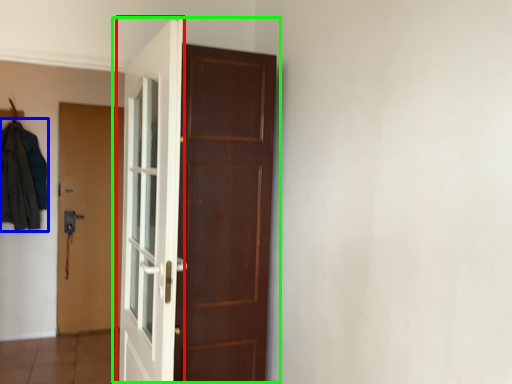
Question: Which object is positioned closest to door (highlighted by a red box)? Select from clothing (highlighted by a blue box) and door (highlighted by a green box).

Choices:
 (A) clothing
 (B) door

Answer: (B)